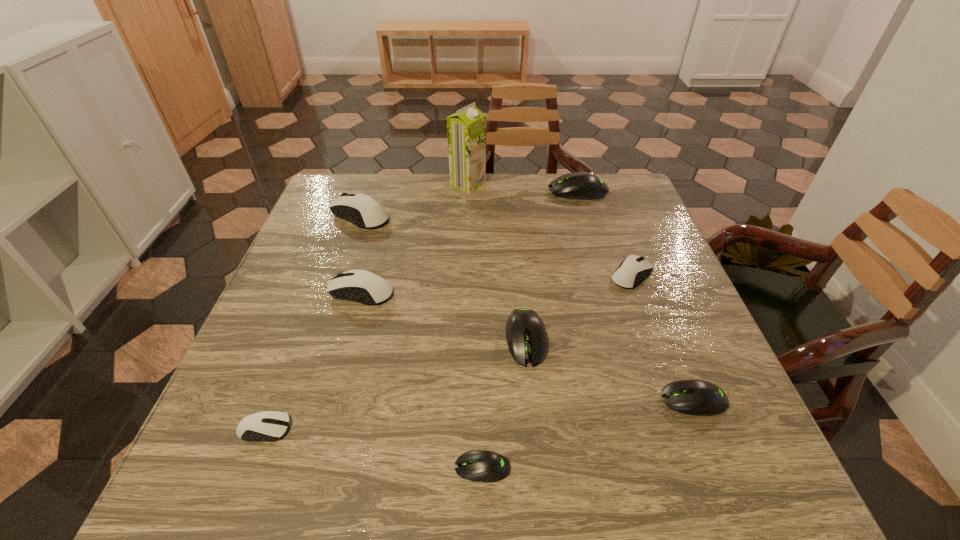
The image size is (960, 540). What are the coordinates of `free point between the third smallest white mouse and the biggest white mouse` in the screenshot? It's located at (361, 253).

Identify the location of free space between the nearest white mouse and the second nearest gray computer mouse. (479, 415).

The width and height of the screenshot is (960, 540). I want to click on free point between the smallest white mouse and the third farthest object, so click(313, 322).

Where is `empty space between the nearest computer mouse and the third smallest white mouse`? This screenshot has height=540, width=960. empty space between the nearest computer mouse and the third smallest white mouse is located at coordinates (421, 380).

At what (x,y) coordinates should I click in order to perform the action: click on vacant space that is in between the seventh nearest computer mouse and the rightmost white mouse. Please return your answer as a coordinate pair (x, y). Looking at the image, I should click on (496, 245).

This screenshot has height=540, width=960. I want to click on blank region between the third gray computer mouse from right to left and the green soya milk, so click(x=496, y=261).

This screenshot has width=960, height=540. Identify the location of free point between the second farthest computer mouse and the second smallest white mouse. pos(496,245).

I want to click on vacant area that lies between the seventh nearest object and the farthest computer mouse, so click(469, 203).

At what (x,y) coordinates should I click in order to perform the action: click on vacant area that lies between the farthest white mouse and the tallest object. Please return your answer as a coordinate pair (x, y). The image size is (960, 540). Looking at the image, I should click on tap(415, 200).

The image size is (960, 540). What are the coordinates of `object that stands as the fourth closest to the second nearest object` in the screenshot? It's located at (360, 209).